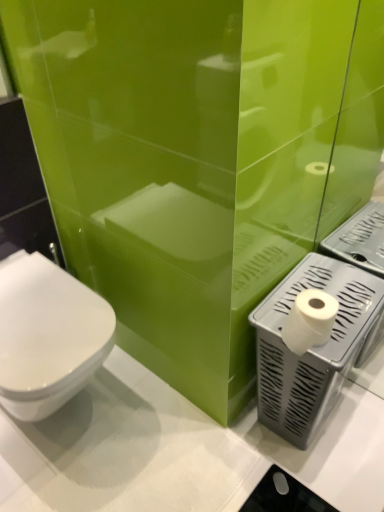
You are a GUI agent. You are given a task and a screenshot of the screen. Output one action in this format:
    pyautogui.click(x=<x>, y=<y>)
    Task: Click on the vacant area situated below white glossy toilet at left (from a real-world perspective)
    This screenshot has height=512, width=384.
    Given the screenshot: What is the action you would take?
    pyautogui.click(x=73, y=422)